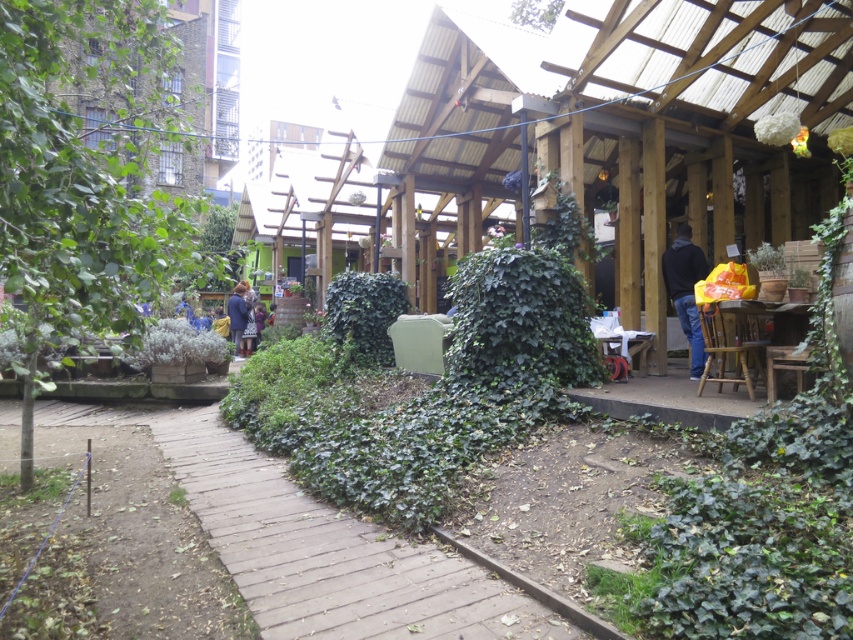
Question: Can you confirm if wooden chair at right is bigger than blue fabric jacket at center-left?

Choices:
 (A) yes
 (B) no

Answer: (B)

Question: Which point is farther to the camera?

Choices:
 (A) dark blue hoodie at right
 (B) wooden chair at right
 (C) green leafy bush at left
 (D) wooden table at center

Answer: (A)

Question: Which object appears farthest from the camera in this image?

Choices:
 (A) green leafy bush at left
 (B) dark blue hoodie at right
 (C) wooden pergola at center
 (D) wooden chair at right

Answer: (C)

Question: In this image, where is wooden table at right located relative to blue fabric jacket at center-left?

Choices:
 (A) right
 (B) left

Answer: (A)

Question: Is green leafy bush at left smaller than blue fabric jacket at center-left?

Choices:
 (A) yes
 (B) no

Answer: (B)

Question: Among these objects, which one is nearest to the camera?

Choices:
 (A) wooden table at center
 (B) brown wooden path at center
 (C) wooden pergola at center

Answer: (B)